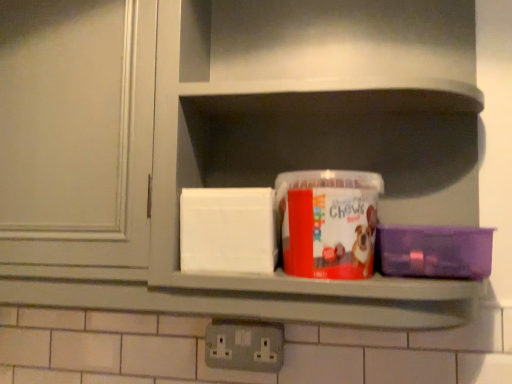
Question: Should I look upward or downward to see gray plastic electrical outlet at lower center?

Choices:
 (A) up
 (B) down

Answer: (B)

Question: Is gray plastic electrical outlet at lower center to the left of matte plastic container at center from the viewer's perspective?

Choices:
 (A) no
 (B) yes

Answer: (B)

Question: Is matte plastic container at center a part of gray plastic electrical outlet at lower center?

Choices:
 (A) no
 (B) yes

Answer: (A)

Question: Considering the relative sizes of gray plastic electrical outlet at lower center and matte plastic container at center in the image provided, is gray plastic electrical outlet at lower center shorter than matte plastic container at center?

Choices:
 (A) no
 (B) yes

Answer: (B)

Question: Would you consider gray plastic electrical outlet at lower center to be distant from matte plastic container at center?

Choices:
 (A) yes
 (B) no

Answer: (B)

Question: Is gray plastic electrical outlet at lower center facing towards matte plastic container at center?

Choices:
 (A) no
 (B) yes

Answer: (A)

Question: Is gray plastic electrical outlet at lower center at the right side of matte plastic container at center?

Choices:
 (A) yes
 (B) no

Answer: (B)

Question: Is purple plastic container at right, which appears as the 1th box when viewed from the right, further to camera compared to translucent plastic container at center, the 1th box positioned from the left?

Choices:
 (A) no
 (B) yes

Answer: (B)

Question: Is translucent plastic container at center, the 1th box positioned from the left, at the back of purple plastic container at right, which appears as the 1th box when viewed from the right?

Choices:
 (A) yes
 (B) no

Answer: (B)

Question: Is purple plastic container at right, which appears as the 1th box when viewed from the right, facing towards translucent plastic container at center, the 1th box positioned from the left?

Choices:
 (A) no
 (B) yes

Answer: (A)

Question: Considering the relative sizes of purple plastic container at right, positioned as the second box in left-to-right order, and translucent plastic container at center, which is the 2th box in right-to-left order, in the image provided, is purple plastic container at right, positioned as the second box in left-to-right order, smaller than translucent plastic container at center, which is the 2th box in right-to-left order,?

Choices:
 (A) yes
 (B) no

Answer: (A)

Question: Does purple plastic container at right, positioned as the second box in left-to-right order, have a lesser width compared to translucent plastic container at center, the 1th box positioned from the left?

Choices:
 (A) no
 (B) yes

Answer: (B)

Question: Is purple plastic container at right, positioned as the second box in left-to-right order, located outside translucent plastic container at center, the 1th box positioned from the left?

Choices:
 (A) yes
 (B) no

Answer: (A)

Question: Is gray plastic electrical outlet at lower center at the back of matte plastic container at center?

Choices:
 (A) no
 (B) yes

Answer: (A)